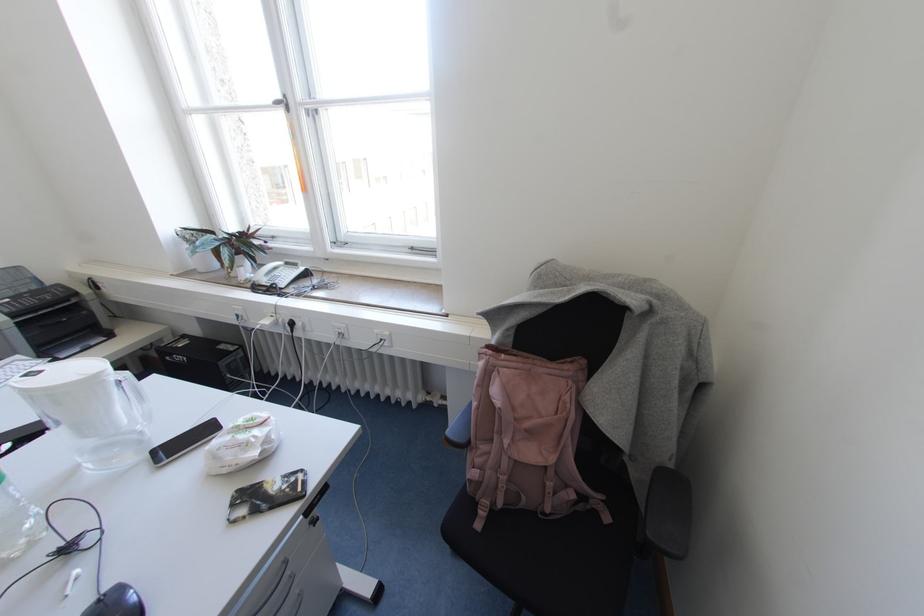
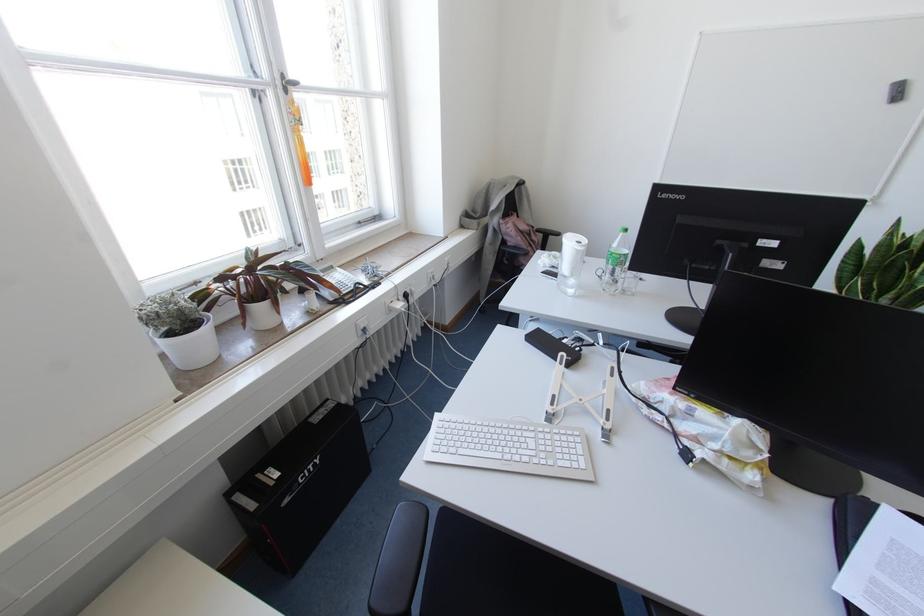
In the second image, find the point that corresponds to (x=287, y=108) in the first image.

(285, 90)